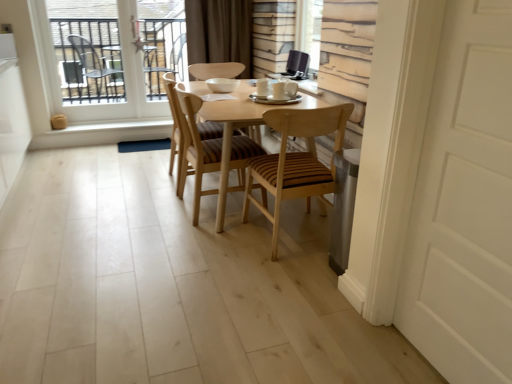
Locate an element on the screen. The image size is (512, 384). vacant space that is to the left of wooden striped chair at center, marked as the third chair in a left-to-right arrangement is located at coordinates (208, 252).